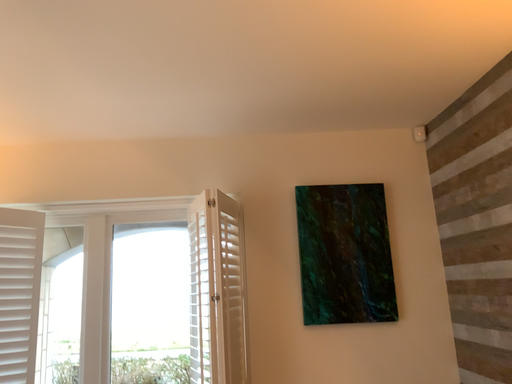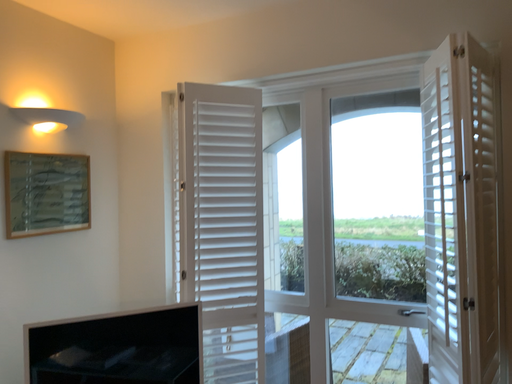
Question: Which way did the camera rotate in the video?

Choices:
 (A) rotated downward
 (B) rotated upward

Answer: (A)